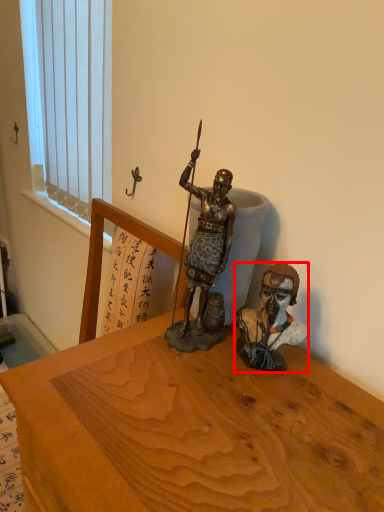
Question: In this image, where is person (annotated by the red box) located relative to window?

Choices:
 (A) left
 (B) right

Answer: (B)